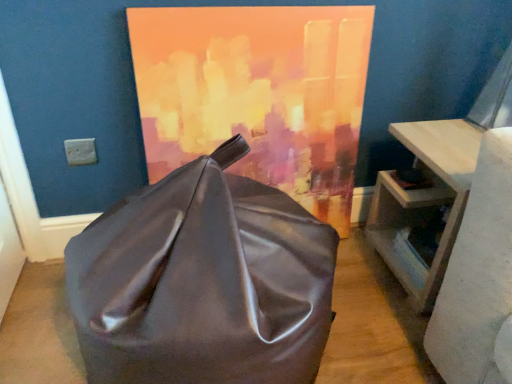
Question: Can you confirm if light wood table at right is smaller than shiny brown bean bag at center?

Choices:
 (A) no
 (B) yes

Answer: (B)

Question: Is light wood table at right bigger than shiny brown bean bag at center?

Choices:
 (A) yes
 (B) no

Answer: (B)

Question: From a real-world perspective, is light wood table at right positioned under shiny brown bean bag at center based on gravity?

Choices:
 (A) yes
 (B) no

Answer: (A)

Question: Can you see light wood table at right touching shiny brown bean bag at center?

Choices:
 (A) no
 (B) yes

Answer: (A)

Question: Considering the relative sizes of light wood table at right and shiny brown bean bag at center in the image provided, is light wood table at right shorter than shiny brown bean bag at center?

Choices:
 (A) no
 (B) yes

Answer: (B)

Question: Looking at their shapes, would you say matte acrylic painting at center is wider or thinner than shiny brown bean bag at center?

Choices:
 (A) thin
 (B) wide

Answer: (A)

Question: From the image's perspective, is matte acrylic painting at center located above or below shiny brown bean bag at center?

Choices:
 (A) below
 (B) above

Answer: (B)

Question: Does point (253, 26) appear closer or farther from the camera than point (300, 269)?

Choices:
 (A) farther
 (B) closer

Answer: (A)

Question: Considering the relative positions of matte acrylic painting at center and shiny brown bean bag at center in the image provided, is matte acrylic painting at center to the left or to the right of shiny brown bean bag at center?

Choices:
 (A) right
 (B) left

Answer: (A)

Question: Which is correct: shiny brown bean bag at center is inside matte acrylic painting at center, or outside of it?

Choices:
 (A) inside
 (B) outside

Answer: (B)

Question: Does point (240, 208) appear closer or farther from the camera than point (314, 178)?

Choices:
 (A) farther
 (B) closer

Answer: (B)

Question: Is shiny brown bean bag at center wider or thinner than matte acrylic painting at center?

Choices:
 (A) wide
 (B) thin

Answer: (A)

Question: From a real-world perspective, is shiny brown bean bag at center positioned above or below matte acrylic painting at center?

Choices:
 (A) above
 (B) below

Answer: (B)

Question: From the image's perspective, is light wood table at right located above or below shiny brown bean bag at center?

Choices:
 (A) below
 (B) above

Answer: (B)

Question: Is light wood table at right wider or thinner than shiny brown bean bag at center?

Choices:
 (A) wide
 (B) thin

Answer: (B)